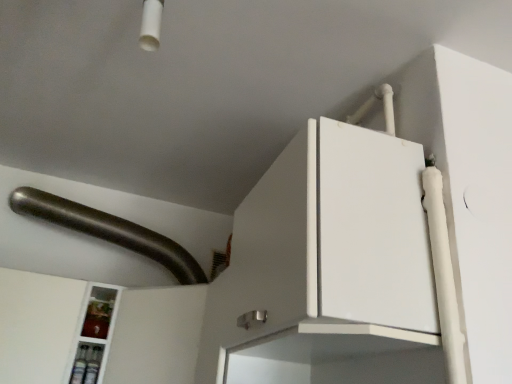
Question: From a real-world perspective, is white glossy cabinet at lower left on top of satin silver handle at upper left?

Choices:
 (A) no
 (B) yes

Answer: (A)

Question: Is satin silver handle at upper left at the back of white glossy cabinet at lower left?

Choices:
 (A) yes
 (B) no

Answer: (B)

Question: Are white glossy cabinet at lower left and satin silver handle at upper left located far from each other?

Choices:
 (A) no
 (B) yes

Answer: (A)

Question: From a real-world perspective, is white glossy cabinet at lower left below satin silver handle at upper left?

Choices:
 (A) no
 (B) yes

Answer: (B)

Question: Considering the relative positions of white glossy cabinet at lower left and satin silver handle at upper left in the image provided, is white glossy cabinet at lower left in front of satin silver handle at upper left?

Choices:
 (A) yes
 (B) no

Answer: (A)

Question: Is white glossy cabinet at lower left located outside satin silver handle at upper left?

Choices:
 (A) yes
 (B) no

Answer: (A)

Question: Is satin silver handle at upper left oriented away from white glossy cabinet at lower left?

Choices:
 (A) no
 (B) yes

Answer: (A)

Question: Does satin silver handle at upper left appear on the left side of white glossy cabinet at lower left?

Choices:
 (A) yes
 (B) no

Answer: (B)

Question: Is satin silver handle at upper left completely or partially outside of white glossy cabinet at lower left?

Choices:
 (A) yes
 (B) no

Answer: (A)

Question: Is white glossy cabinet at lower left surrounded by satin silver handle at upper left?

Choices:
 (A) no
 (B) yes

Answer: (A)

Question: Considering the relative sizes of satin silver handle at upper left and white glossy cabinet at lower left in the image provided, is satin silver handle at upper left smaller than white glossy cabinet at lower left?

Choices:
 (A) yes
 (B) no

Answer: (B)

Question: Is satin silver handle at upper left wider than white glossy cabinet at lower left?

Choices:
 (A) yes
 (B) no

Answer: (A)

Question: Is satin silver handle at upper left bigger or smaller than white glossy cabinet at lower left?

Choices:
 (A) big
 (B) small

Answer: (A)